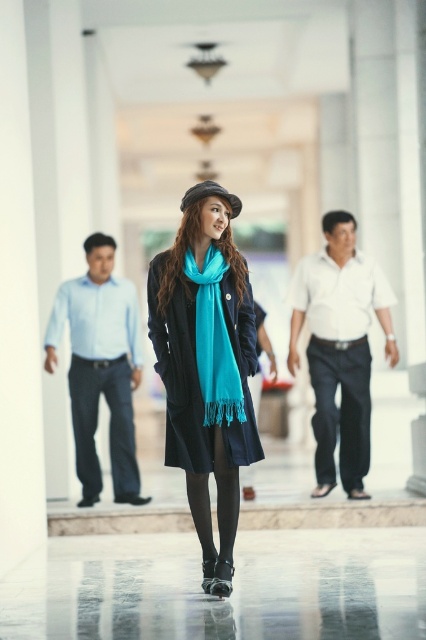
Question: Is matte black coat at center bigger than light blue shirt at left?

Choices:
 (A) yes
 (B) no

Answer: (B)

Question: Which point is farther to the camera?

Choices:
 (A) dark blue jeans at center
 (B) teal silk scarf at center
 (C) denim pants at left
 (D) white cotton shirt at right

Answer: (C)

Question: In this image, where is white cotton shirt at right located relative to dark blue jeans at center?

Choices:
 (A) below
 (B) above

Answer: (B)

Question: Which of the following is the farthest from the observer?

Choices:
 (A) (353, 477)
 (B) (218, 332)

Answer: (A)

Question: Is teal silk scarf at center bigger than matte black hat at center?

Choices:
 (A) yes
 (B) no

Answer: (A)

Question: Which point is closer to the camera taking this photo?

Choices:
 (A) (316, 412)
 (B) (187, 193)

Answer: (B)